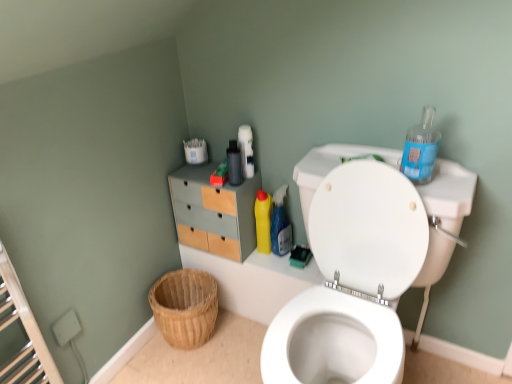
This screenshot has height=384, width=512. I want to click on unoccupied region to the right of woven wood basket at lower left, so click(241, 336).